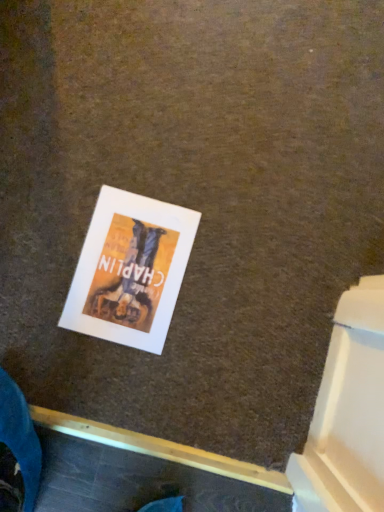
Find the location of a particular element. The height and width of the screenshot is (512, 384). vacant area on the back side of matte paper poster at center is located at coordinates (144, 157).